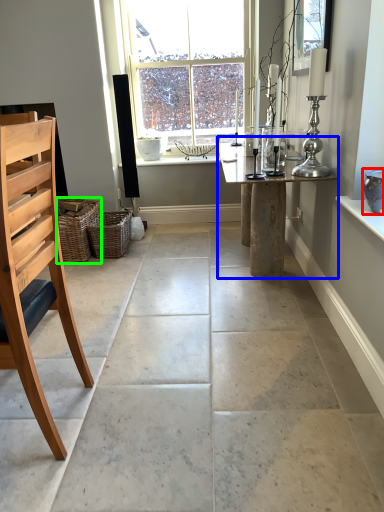
Question: Which is farther away from vase (highlighted by a red box)? table (highlighted by a blue box) or basket (highlighted by a green box)?

Choices:
 (A) table
 (B) basket

Answer: (B)